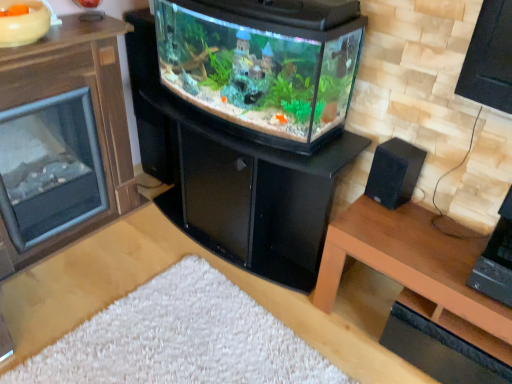
Where is `vacant space in front of black matte speaker at right`? The height and width of the screenshot is (384, 512). vacant space in front of black matte speaker at right is located at coordinates (395, 228).